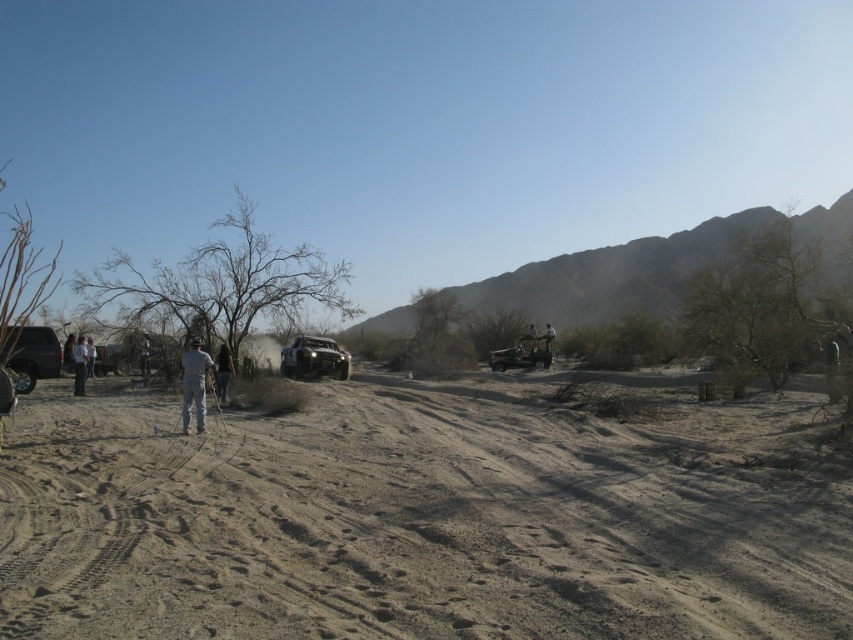
This screenshot has width=853, height=640. What do you see at coordinates (194, 384) in the screenshot?
I see `gray cotton shirt at center` at bounding box center [194, 384].

Is point (189, 419) less distant than point (88, 348)?

Yes.

Who is more forward, (x=202, y=388) or (x=86, y=352)?

Positioned in front is point (x=202, y=388).

Find the location of a particular element. This screenshot has height=640, width=853. gray cotton shirt at center is located at coordinates (194, 384).

Who is positioned more to the left, green fabric shirt at right or dark gray fabric person at center?

From the viewer's perspective, dark gray fabric person at center appears more on the left side.

Who is positioned more to the right, green fabric shirt at right or dark gray fabric person at center?

green fabric shirt at right

Is point (822, 344) closer to viewer compared to point (544, 342)?

Yes, point (822, 344) is closer to viewer.

I want to click on green fabric shirt at right, so click(830, 365).

Does dull brown dirt at center lie behind matte black truck at left?

No, dull brown dirt at center is closer to the viewer.

Does dull brown dirt at center have a lesser height compared to matte black truck at left?

Yes, dull brown dirt at center is shorter than matte black truck at left.

You are a GUI agent. You are given a task and a screenshot of the screen. Output one action in this format:
    pyautogui.click(x=<x>, y=<y>)
    Task: Click on the dull brown dirt at center
    
    Given the screenshot: What is the action you would take?
    pyautogui.click(x=422, y=518)